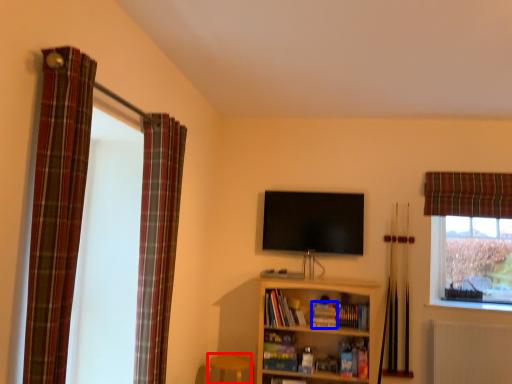
Question: Among these objects, which one is farthest to the camera, bar stool (highlighted by a red box) or book (highlighted by a blue box)?

Choices:
 (A) bar stool
 (B) book

Answer: (B)